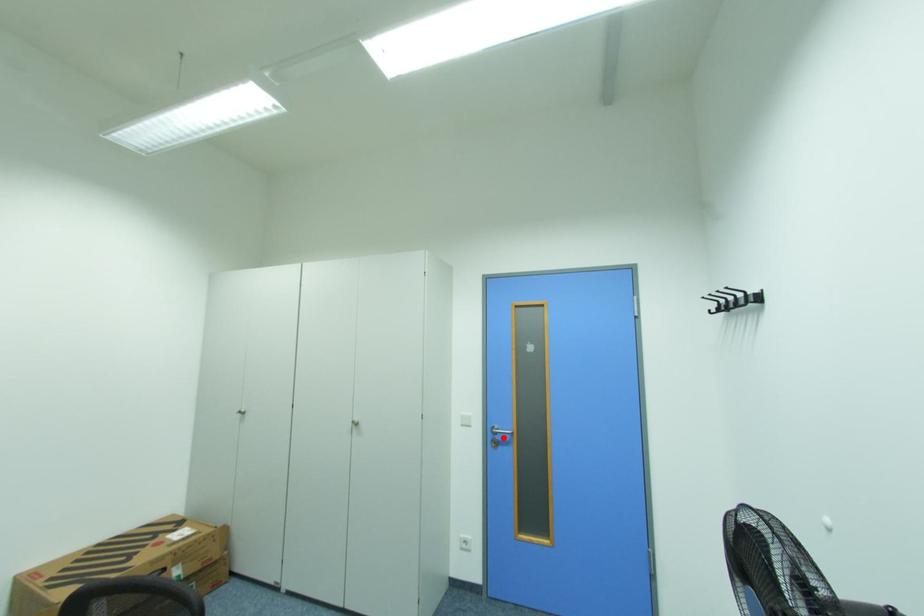
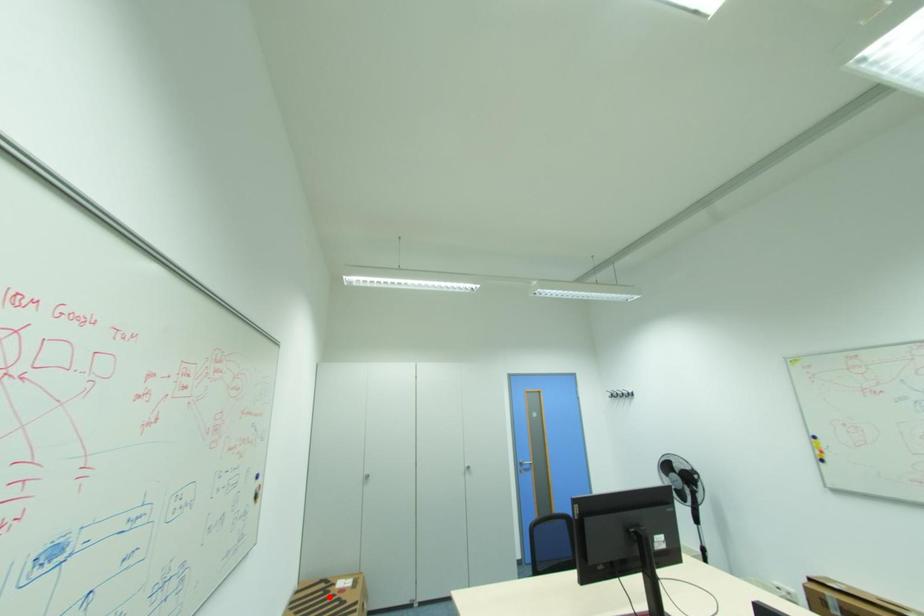
I am providing you with two images of the same scene from different viewpoints. A red point is marked on the first image and another point is marked on the second image. Are the points marked in image1 and image2 representing the same 3D position?

No